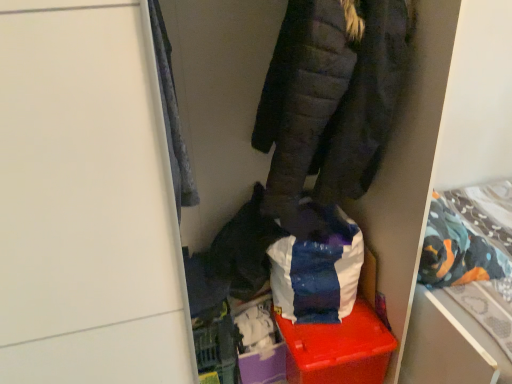
Question: From a real-world perspective, is velvety gray blanket at upper left positioned under patterned fabric bed at right based on gravity?

Choices:
 (A) yes
 (B) no

Answer: (B)

Question: Does velvety gray blanket at upper left touch patterned fabric bed at right?

Choices:
 (A) no
 (B) yes

Answer: (A)

Question: Is patterned fabric bed at right inside velvety gray blanket at upper left?

Choices:
 (A) yes
 (B) no

Answer: (B)

Question: Is velvety gray blanket at upper left behind patterned fabric bed at right?

Choices:
 (A) no
 (B) yes

Answer: (A)

Question: Can we say velvety gray blanket at upper left lies outside patterned fabric bed at right?

Choices:
 (A) yes
 (B) no

Answer: (A)

Question: Is velvety gray blanket at upper left positioned with its back to patterned fabric bed at right?

Choices:
 (A) yes
 (B) no

Answer: (B)

Question: Does velvety gray blanket at upper left have a lesser height compared to dark gray quilted jacket at upper center?

Choices:
 (A) no
 (B) yes

Answer: (A)

Question: Does velvety gray blanket at upper left lie behind dark gray quilted jacket at upper center?

Choices:
 (A) yes
 (B) no

Answer: (B)

Question: From a real-world perspective, is velvety gray blanket at upper left located beneath dark gray quilted jacket at upper center?

Choices:
 (A) yes
 (B) no

Answer: (B)

Question: Is velvety gray blanket at upper left oriented towards dark gray quilted jacket at upper center?

Choices:
 (A) yes
 (B) no

Answer: (B)

Question: Is the surface of velvety gray blanket at upper left in direct contact with dark gray quilted jacket at upper center?

Choices:
 (A) no
 (B) yes

Answer: (A)

Question: From the image's perspective, is velvety gray blanket at upper left over dark gray quilted jacket at upper center?

Choices:
 (A) no
 (B) yes

Answer: (A)

Question: Is patterned fabric bed at right behind velvety gray blanket at upper left?

Choices:
 (A) yes
 (B) no

Answer: (A)